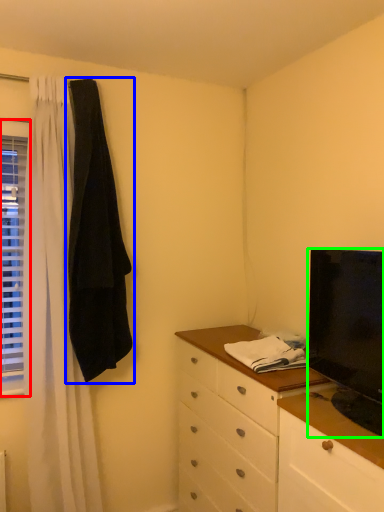
Question: Which object is positioned farthest from window (highlighted by a red box)? Select from robe (highlighted by a blue box) and television (highlighted by a green box).

Choices:
 (A) robe
 (B) television

Answer: (B)